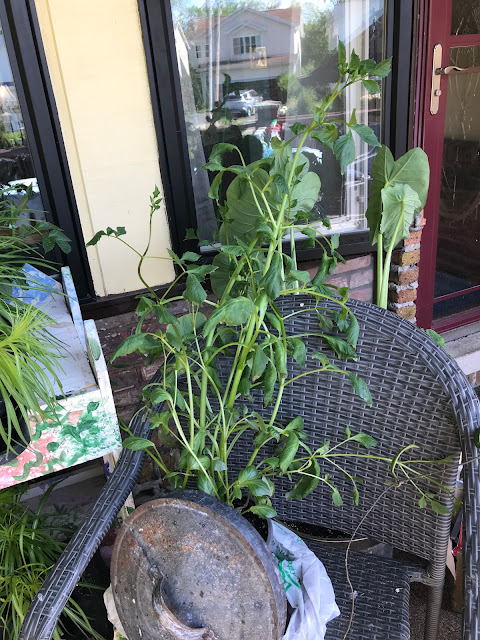
The height and width of the screenshot is (640, 480). I want to click on chair, so (398, 425).